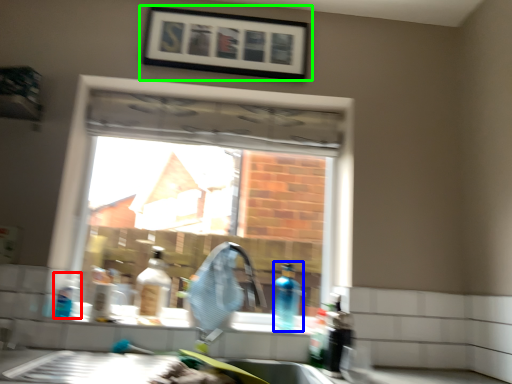
Question: Considering the real-world distances, which object is closest to bottle (highlighted by a red box)? bottle (highlighted by a blue box) or picture frame (highlighted by a green box).

Choices:
 (A) bottle
 (B) picture frame

Answer: (A)